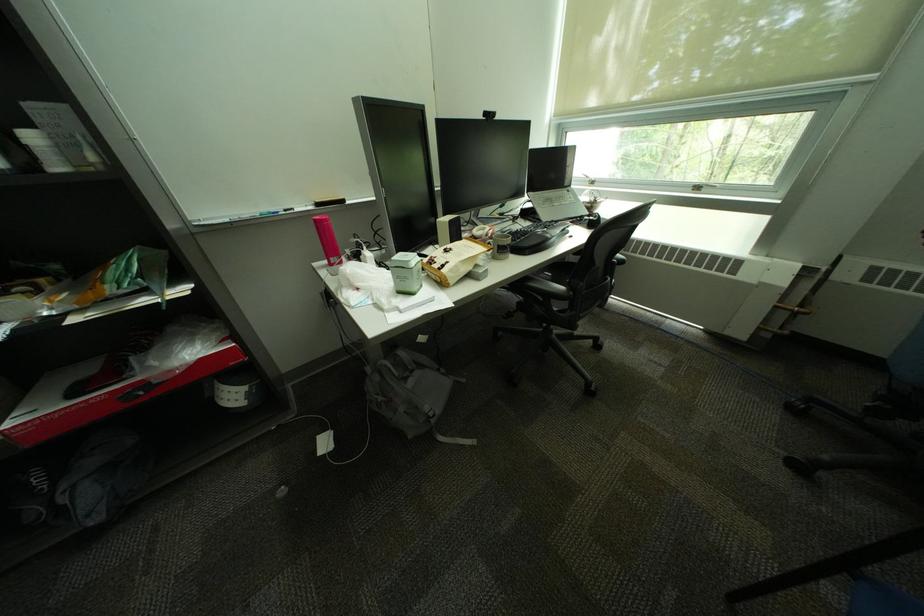
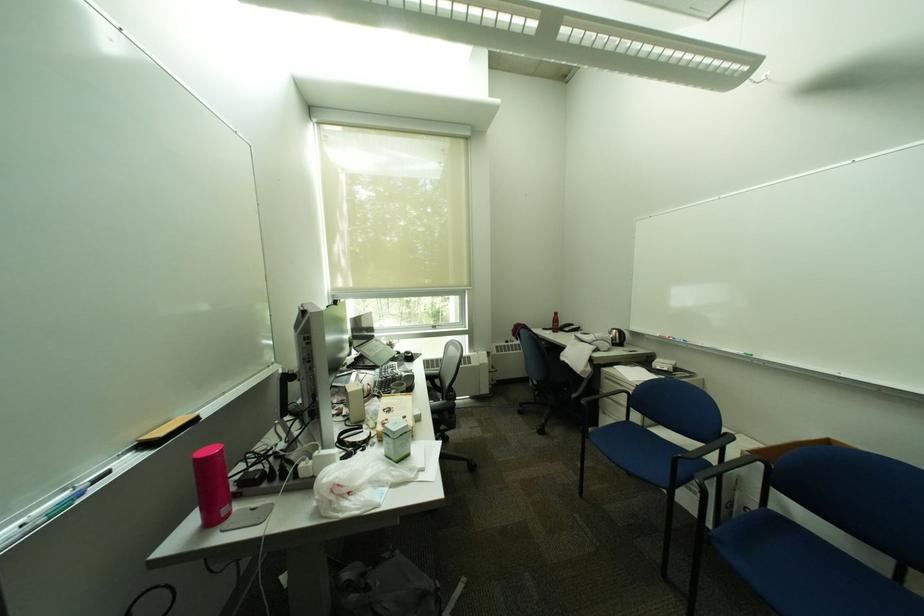
Locate, in the second image, the point that corresponds to (x=323, y=222) in the first image.

(202, 464)